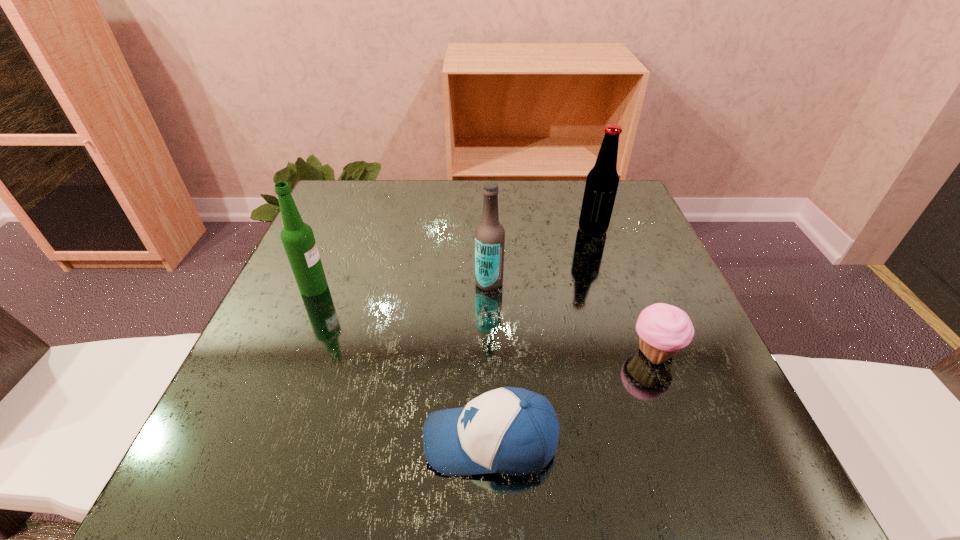
You are a GUI agent. You are given a task and a screenshot of the screen. Output one action in this format:
    pyautogui.click(x=<x>, y=<y>)
    Task: Click on the farthest beer bottle
    This screenshot has height=540, width=960.
    Given the screenshot: What is the action you would take?
    pyautogui.click(x=602, y=181)

You are a GUI agent. You are given a task and a screenshot of the screen. Output one action in this format:
    pyautogui.click(x=<x>, y=<y>)
    Task: Click on the farthest object
    The height and width of the screenshot is (540, 960).
    Given the screenshot: What is the action you would take?
    pyautogui.click(x=602, y=181)

The width and height of the screenshot is (960, 540). In order to click on the leftmost object in this screenshot , I will do `click(297, 237)`.

This screenshot has height=540, width=960. I want to click on the second beer bottle from left to right, so click(490, 235).

The height and width of the screenshot is (540, 960). In order to click on the fourth farthest object in this screenshot , I will do `click(663, 329)`.

You are a GUI agent. You are given a task and a screenshot of the screen. Output one action in this format:
    pyautogui.click(x=<x>, y=<y>)
    Task: Click on the baseball cap
    This screenshot has width=960, height=540.
    Given the screenshot: What is the action you would take?
    pyautogui.click(x=509, y=430)

You are a GUI agent. You are given a task and a screenshot of the screen. Output one action in this format:
    pyautogui.click(x=<x>, y=<y>)
    Task: Click on the vacant space located 0.130m on the left of the rightmost beer bottle
    
    Given the screenshot: What is the action you would take?
    pyautogui.click(x=525, y=230)

Image resolution: width=960 pixels, height=540 pixels. Identify the location of vacant area situated on the label of the leftmost object. 351,287.

This screenshot has width=960, height=540. I want to click on free location located on the label of the second beer bottle from left to right, so click(x=285, y=282).

You are a GUI agent. You are given a task and a screenshot of the screen. Output one action in this format:
    pyautogui.click(x=<x>, y=<y>)
    Task: Click on the free space located on the label of the second beer bottle from left to right
    The height and width of the screenshot is (540, 960).
    Given the screenshot: What is the action you would take?
    pyautogui.click(x=404, y=282)